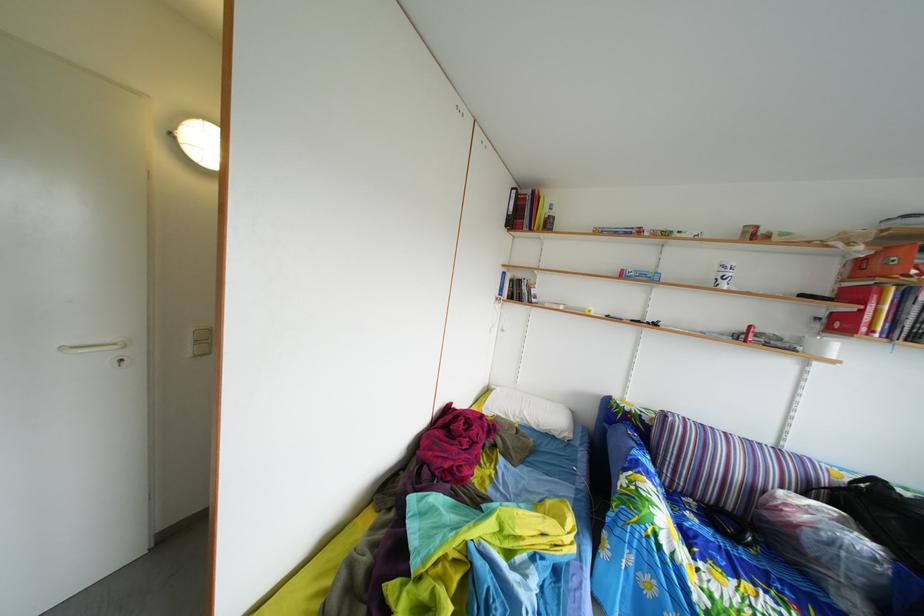
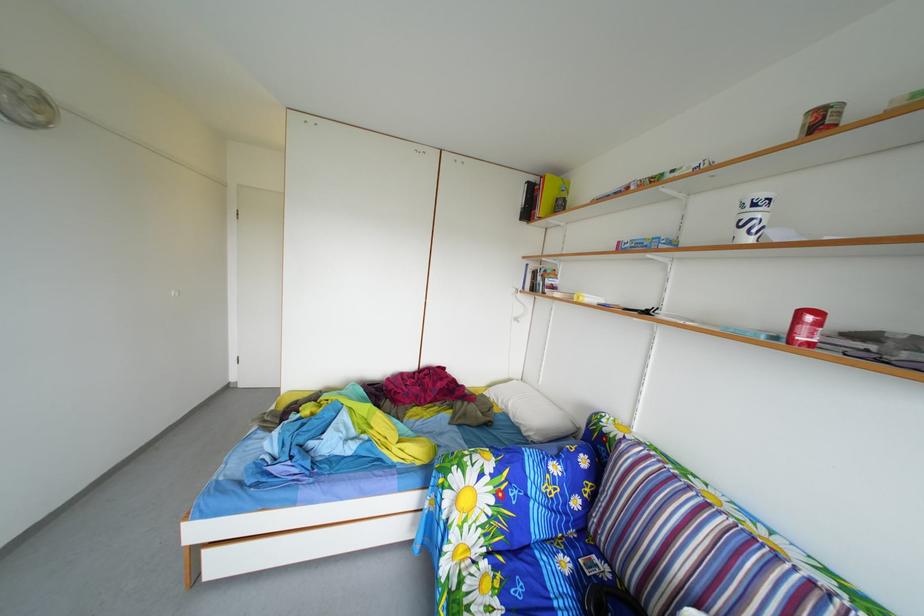
Locate, in the second image, the point that corresponds to point (670, 554) in the first image.

(453, 507)